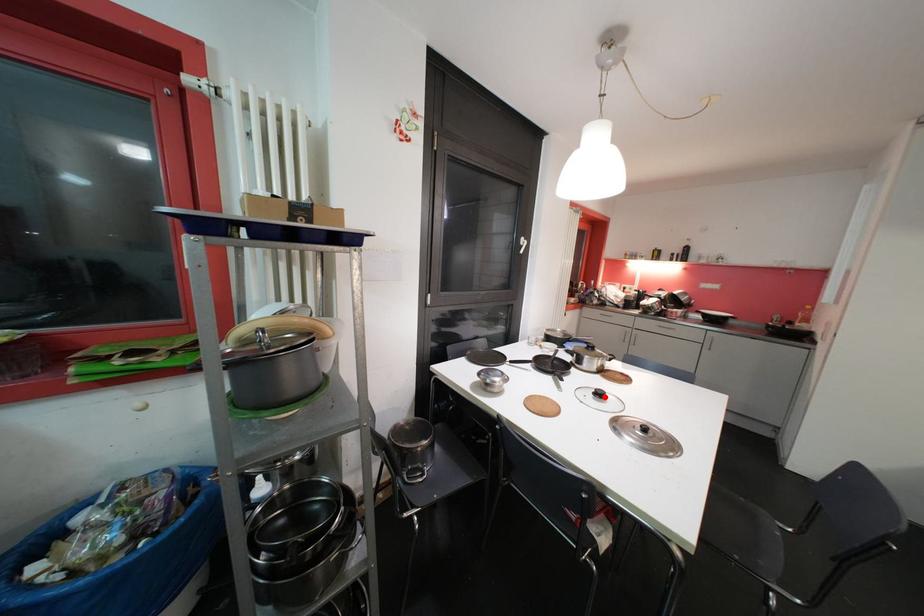
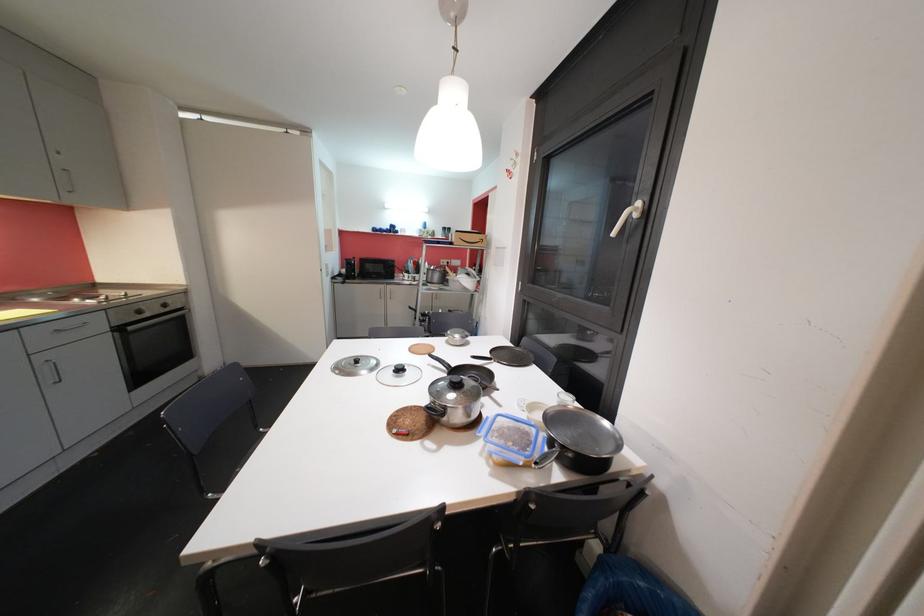
Locate, in the second image, the point that corresponds to the highlighted location in the first image.

(405, 371)